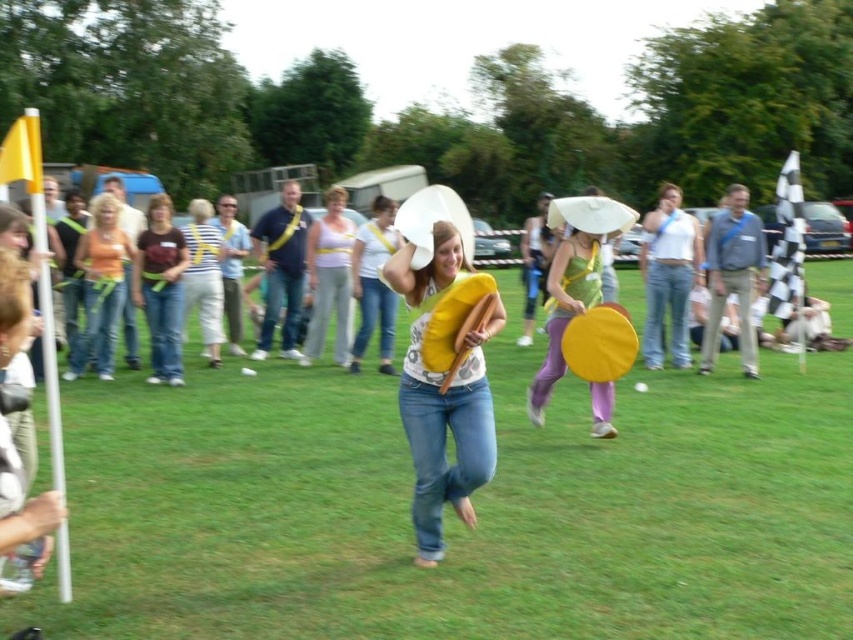
Based on the photo, you are standing in the middle of the field and want to move towards the two points marked in the image. Which point, point (334,566) or point (97,339), is closer to you?

Point (334,566) is closer to the viewer than point (97,339), so you should move toward point (334,566) first.

You are planning to take a photo of the matte yellow frisbee at center and the matte white tank top at center. If the camera can only focus on objects wider than 10 inches, will both objects be in focus?

The matte yellow frisbee at center is wider than the matte white tank top at center. Since the camera focuses on objects wider than 10 inches, the matte yellow frisbee at center will be in focus, but the matte white tank top at center may not be if it is narrower than 10 inches. However, without knowing the exact width of the matte white tank top at center, we cannot confirm its focus status.